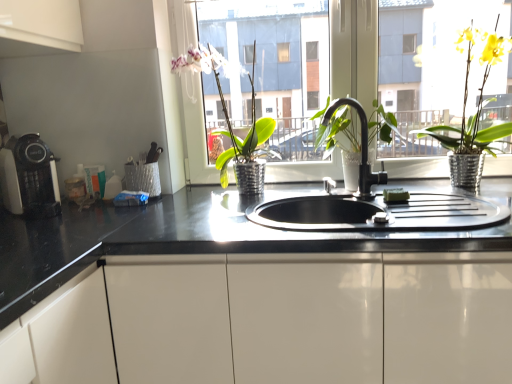
Question: Does black matte faucet at center have a larger size compared to transparent glass window at center?

Choices:
 (A) no
 (B) yes

Answer: (A)

Question: From the image's perspective, would you say black matte faucet at center is positioned over transparent glass window at center?

Choices:
 (A) no
 (B) yes

Answer: (A)

Question: Is black matte faucet at center to the right of transparent glass window at center from the viewer's perspective?

Choices:
 (A) no
 (B) yes

Answer: (A)

Question: Can you confirm if black matte faucet at center is taller than transparent glass window at center?

Choices:
 (A) yes
 (B) no

Answer: (B)

Question: From a real-world perspective, is black matte faucet at center physically above transparent glass window at center?

Choices:
 (A) no
 (B) yes

Answer: (A)

Question: Does black matte faucet at center lie in front of transparent glass window at center?

Choices:
 (A) no
 (B) yes

Answer: (B)

Question: Is green metallic pot at center, which is counted as the second houseplant, starting from the right, behind transparent glass window at center?

Choices:
 (A) no
 (B) yes

Answer: (A)

Question: From a real-world perspective, is green metallic pot at center, the 1th houseplant from the left, on transparent glass window at center?

Choices:
 (A) yes
 (B) no

Answer: (B)

Question: From the image's perspective, is green metallic pot at center, which is counted as the second houseplant, starting from the right, on top of transparent glass window at center?

Choices:
 (A) yes
 (B) no

Answer: (B)

Question: Is green metallic pot at center, the 1th houseplant from the left, directly adjacent to transparent glass window at center?

Choices:
 (A) no
 (B) yes

Answer: (A)

Question: Is green metallic pot at center, which is counted as the second houseplant, starting from the right, to the right of transparent glass window at center from the viewer's perspective?

Choices:
 (A) yes
 (B) no

Answer: (B)

Question: Considering the relative positions of green metallic pot at center, the 1th houseplant from the left, and transparent glass window at center in the image provided, is green metallic pot at center, the 1th houseplant from the left, to the left of transparent glass window at center from the viewer's perspective?

Choices:
 (A) yes
 (B) no

Answer: (A)

Question: Is black matte faucet at center located outside matte black coffee machine at left?

Choices:
 (A) yes
 (B) no

Answer: (A)